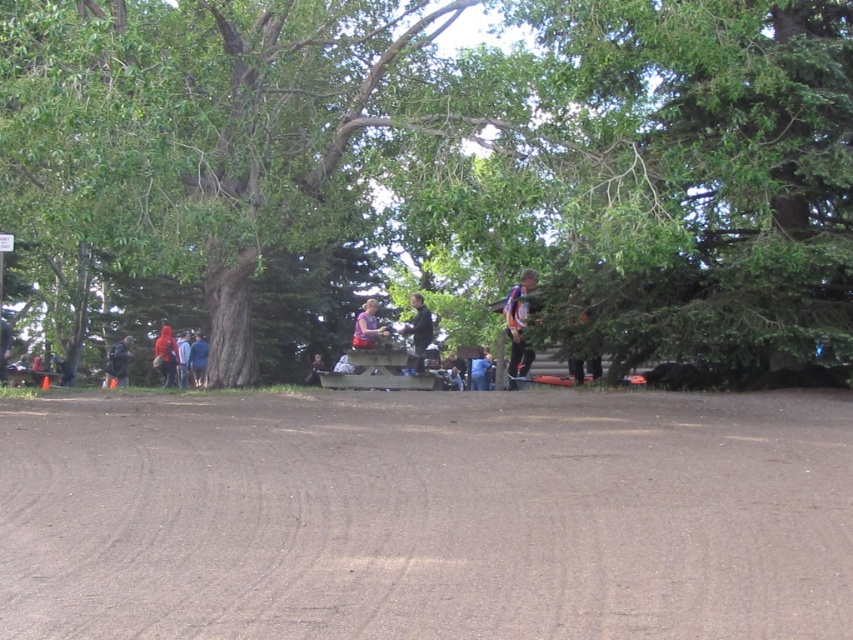
You are a photographer positioned at the edge of the dirt ground in the park scene. You want to take a photo of both the red fabric jacket at lower left and the white cotton shirt at center. However, you need to ensure that neither of them is blocking the other in the shot. Based on their positions, can you position yourself in a way that both are visible without one covering the other?

The white cotton shirt at center is behind the red fabric jacket at lower left. Therefore, positioning yourself so that you can see the red fabric jacket at lower left will naturally allow the white cotton shirt at center to be visible behind it, as it is not in front to block the view.

You are standing at the point labeled as point [445,164] in the image. What object are you directly facing?

The point [445,164] corresponds to the green leafy tree at center, so you are directly facing the green leafy tree at center.

From the picture: You are a photographer standing at the camera position. You want to take a photo of the red fabric jacket at lower left. Can you capture it in your shot without moving the jacket or your position?

The red fabric jacket at lower left is 27.87 meters away from camera, which is within the typical focal range of a camera lens. Therefore, it should be possible to capture the jacket in the photo without moving either the jacket or your position.